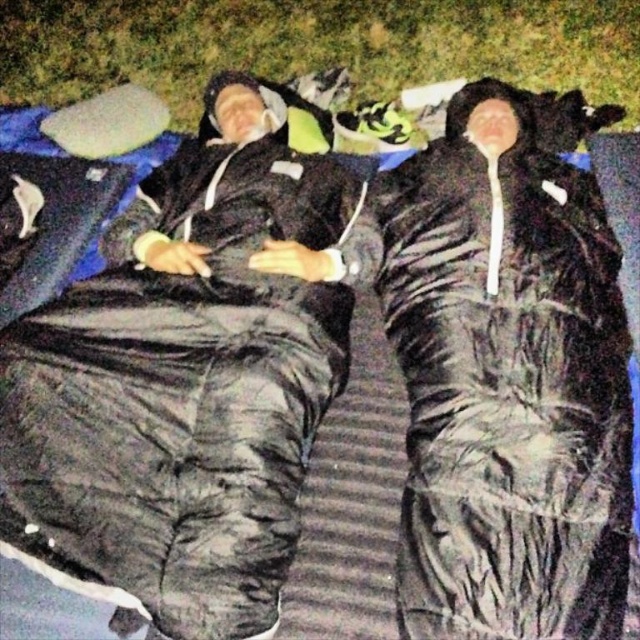
Does black matte sleeping bag at center appear on the left side of green grass at upper center?

A: Correct, you'll find black matte sleeping bag at center to the left of green grass at upper center.

Can you confirm if black matte sleeping bag at center is taller than green grass at upper center?

Yes, black matte sleeping bag at center is taller than green grass at upper center.

Is point (96, 304) in front of point (448, 51)?

Yes.

At what (x,y) coordinates should I click in order to perform the action: click on black matte sleeping bag at center. Please return your answer as a coordinate pair (x, y). The width and height of the screenshot is (640, 640). Looking at the image, I should click on (186, 380).